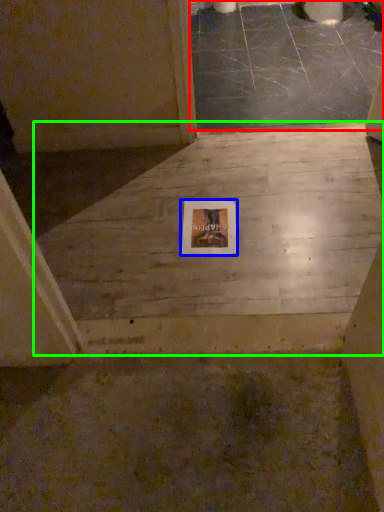
Question: Which object is positioned closest to concrete (highlighted by a red box)? Select from picture frame (highlighted by a blue box) and concrete (highlighted by a green box).

Choices:
 (A) picture frame
 (B) concrete

Answer: (B)